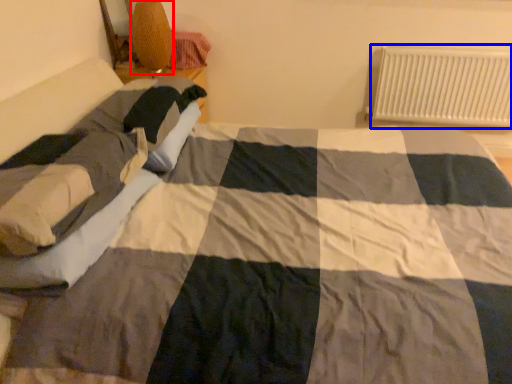
Question: Among these objects, which one is nearest to the camera, lamp (highlighted by a red box) or radiator (highlighted by a blue box)?

Choices:
 (A) lamp
 (B) radiator

Answer: (A)